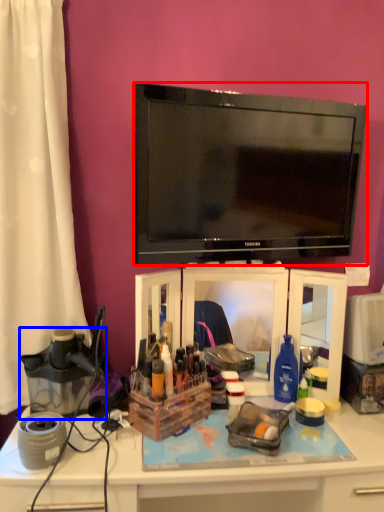
Question: Which object appears closest to the camera in this image, television (highlighted by a red box) or appliance (highlighted by a blue box)?

Choices:
 (A) television
 (B) appliance

Answer: (A)